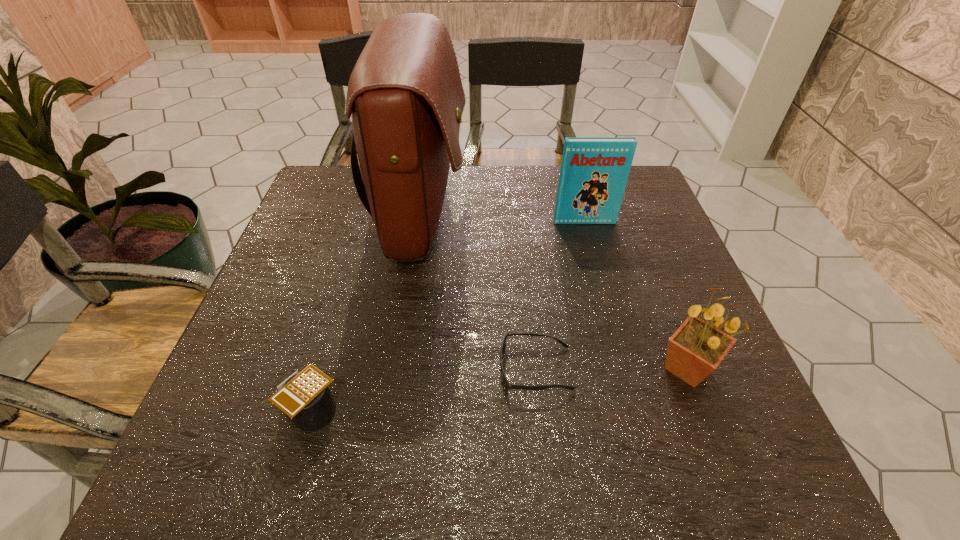
Locate an element on the screen. blank area located 0.220m on the front-facing side of the third object from right to left is located at coordinates (384, 369).

Find the location of a particular element. free location located 0.110m on the front-facing side of the third object from right to left is located at coordinates (442, 369).

Where is `vacant space positioned on the front-facing side of the third object from right to left`? This screenshot has width=960, height=540. vacant space positioned on the front-facing side of the third object from right to left is located at coordinates (290, 369).

Where is `object present at the far edge`? object present at the far edge is located at coordinates (405, 94).

Locate an element on the screen. This screenshot has height=540, width=960. object present at the near edge is located at coordinates (305, 397).

You are a GUI agent. You are given a task and a screenshot of the screen. Output one action in this format:
    pyautogui.click(x=<x>, y=<y>)
    Task: Click on the object present at the left edge
    
    Given the screenshot: What is the action you would take?
    pyautogui.click(x=305, y=397)

Identify the location of book that is positioned at the right edge. This screenshot has height=540, width=960. (594, 171).

You are a GUI agent. You are given a task and a screenshot of the screen. Output one action in this format:
    pyautogui.click(x=<x>, y=<y>)
    Task: Click on the sunflower that is positioned at the right edge
    The height and width of the screenshot is (540, 960).
    Given the screenshot: What is the action you would take?
    pyautogui.click(x=695, y=350)

You are a GUI agent. You are given a task and a screenshot of the screen. Output one action in this format:
    pyautogui.click(x=<x>, y=<y>)
    Task: Click on the object that is at the near left corner
    The image size is (960, 540).
    Given the screenshot: What is the action you would take?
    pyautogui.click(x=305, y=397)

In the image, there is a desktop. What are the coordinates of `vacant space at the far edge` in the screenshot? It's located at (472, 179).